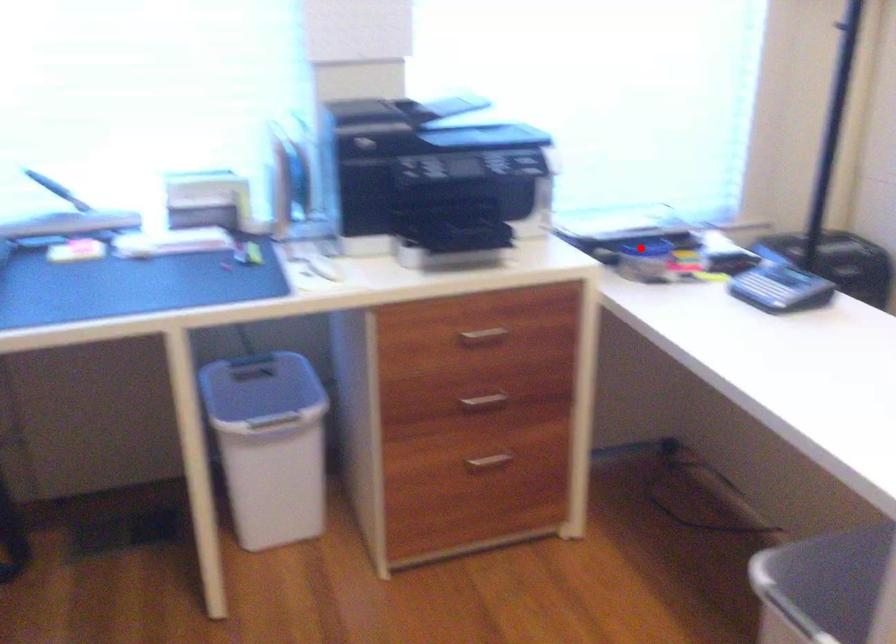
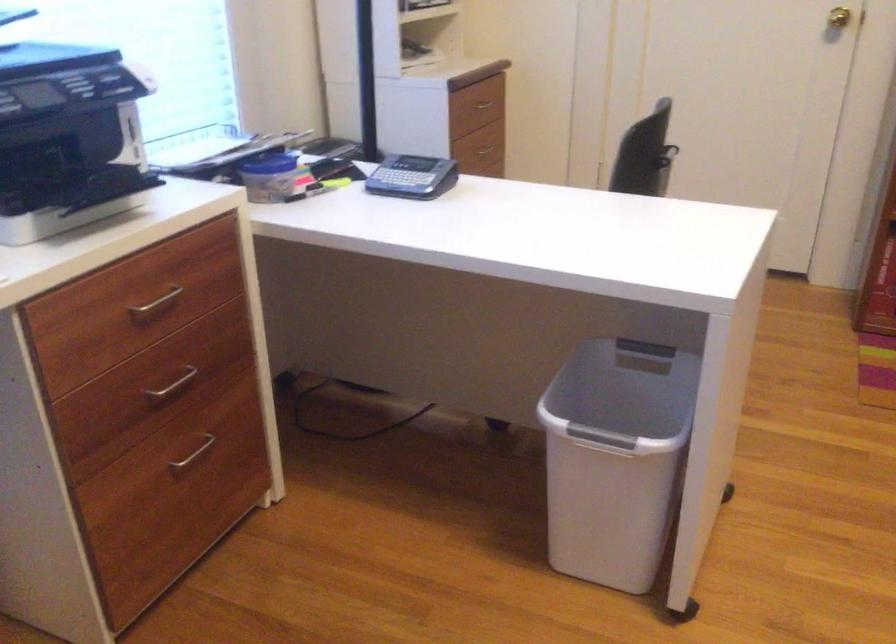
Question: I am providing you with two images of the same scene from different viewpoints. In image1, a red point is highlighted. Considering the same 3D point in image2, which of the following is correct?

Choices:
 (A) It is closer
 (B) It is farther

Answer: (A)